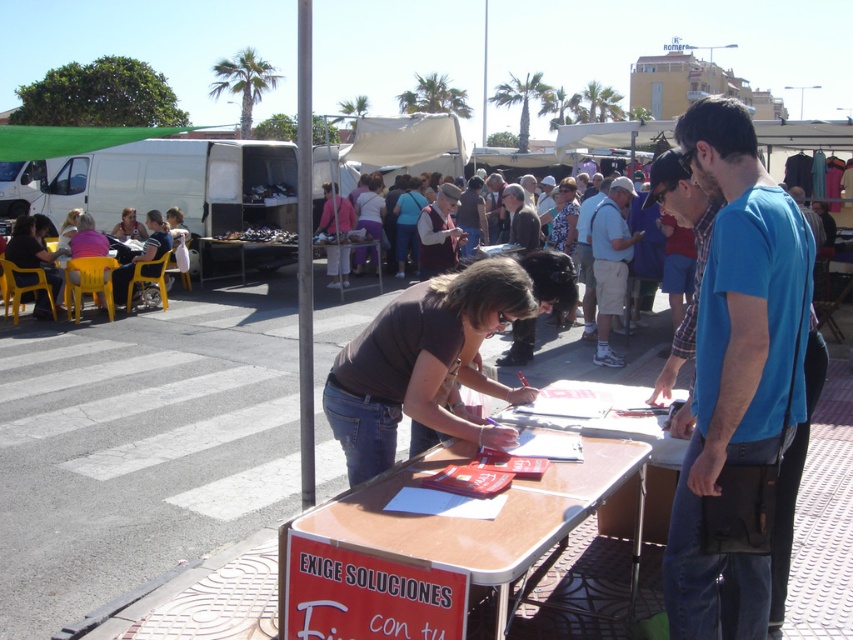
Looking at this image, you are a customer at the outdoor market and want to place a large basket on the brown glossy table at center. However, there is a person wearing pink fabric pants at center sitting on the table. Can the basket fit on the table without removing the person?

The brown glossy table at center might be wider than pink fabric pants at center, so there might be enough space to place the basket alongside the person without removing them.

You are a photographer at the outdoor market scene. You want to take a photo focusing on the light blue shirt at center and dark brown leather jacket at center. Which object should you adjust your camera focus on first to ensure both are in the frame?

The light blue shirt at center is closer to the viewer than the dark brown leather jacket at center, so you should focus on the light blue shirt at center first to ensure both are in the frame.